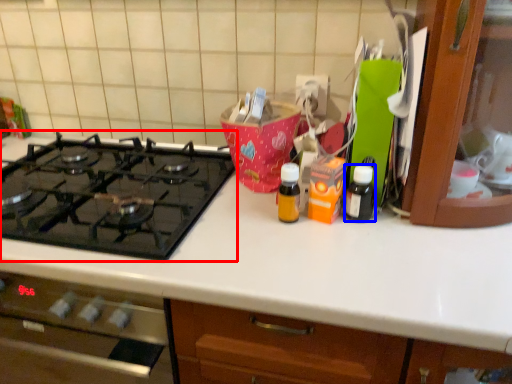
Question: Among these objects, which one is nearest to the camera, gas stove (highlighted by a red box) or bottle (highlighted by a blue box)?

Choices:
 (A) gas stove
 (B) bottle

Answer: (A)